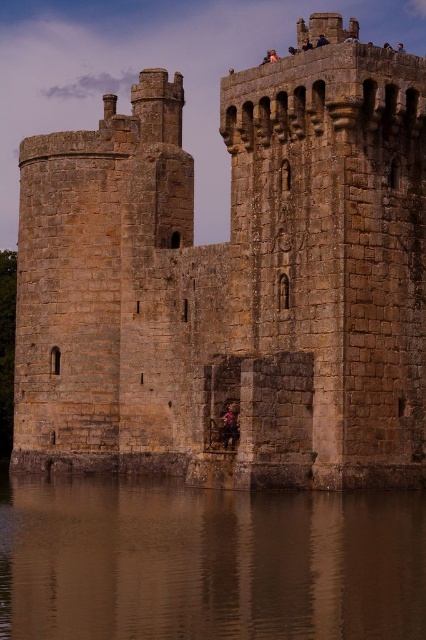
Between brown stone castle at center and dark brown leather jacket at center, which one is positioned higher?

brown stone castle at center

Is brown stone castle at center taller than dark brown leather jacket at center?

Yes.

Locate an element on the screen. brown stone castle at center is located at coordinates (233, 278).

Does brown stone castle at center have a greater width compared to brown matte water at lower center?

Correct, the width of brown stone castle at center exceeds that of brown matte water at lower center.

Is point (305, 387) farther from viewer compared to point (40, 504)?

No.

Does point (393, 74) lie in front of point (411, 541)?

No, it is behind (411, 541).

The width and height of the screenshot is (426, 640). Find the location of `brown stone castle at center`. brown stone castle at center is located at coordinates (233, 278).

In the scene shown: Does brown matte water at lower center appear over dark brown leather jacket at center?

No, brown matte water at lower center is not above dark brown leather jacket at center.

Can you confirm if brown matte water at lower center is positioned below dark brown leather jacket at center?

Yes, brown matte water at lower center is below dark brown leather jacket at center.

Between point (233, 570) and point (230, 424), which one is positioned in front?

Point (233, 570) is more forward.

Image resolution: width=426 pixels, height=640 pixels. What are the coordinates of `brown matte water at lower center` in the screenshot? It's located at (207, 561).